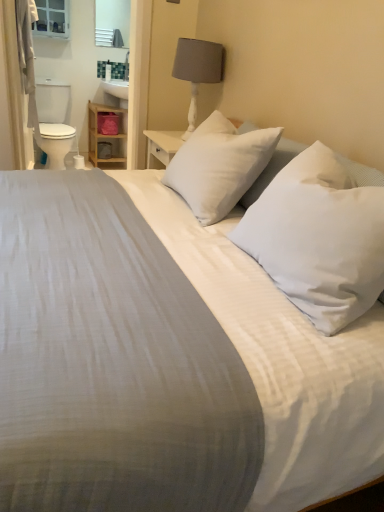
At what (x,y) coordinates should I click in order to perform the action: click on vacant area situated below matte white medicine cabinet at upper left (from a real-world perspective). Please return your answer as a coordinate pair (x, y). The height and width of the screenshot is (512, 384). Looking at the image, I should click on (51, 76).